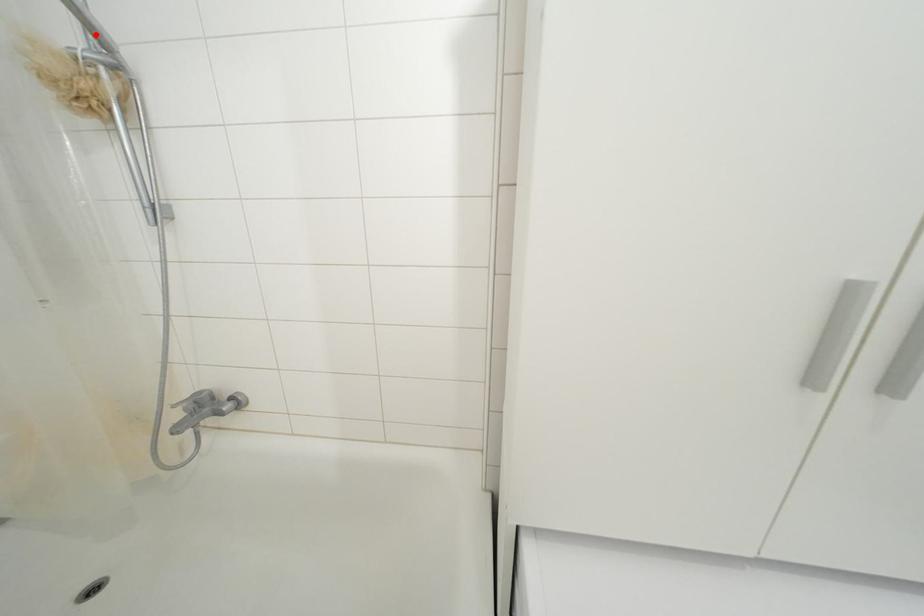
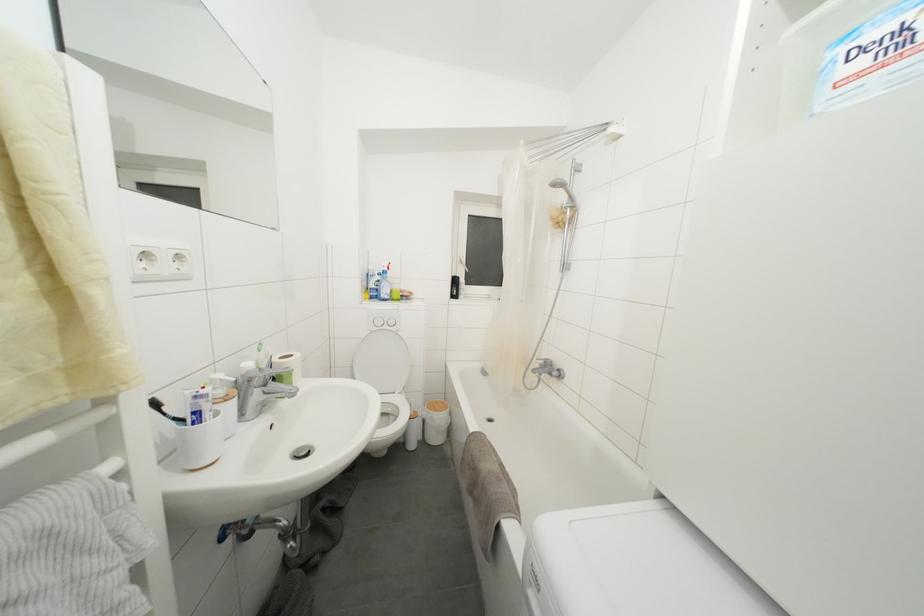
Where in the second image is the point corresponding to the highlighted location from the first image?

(575, 200)